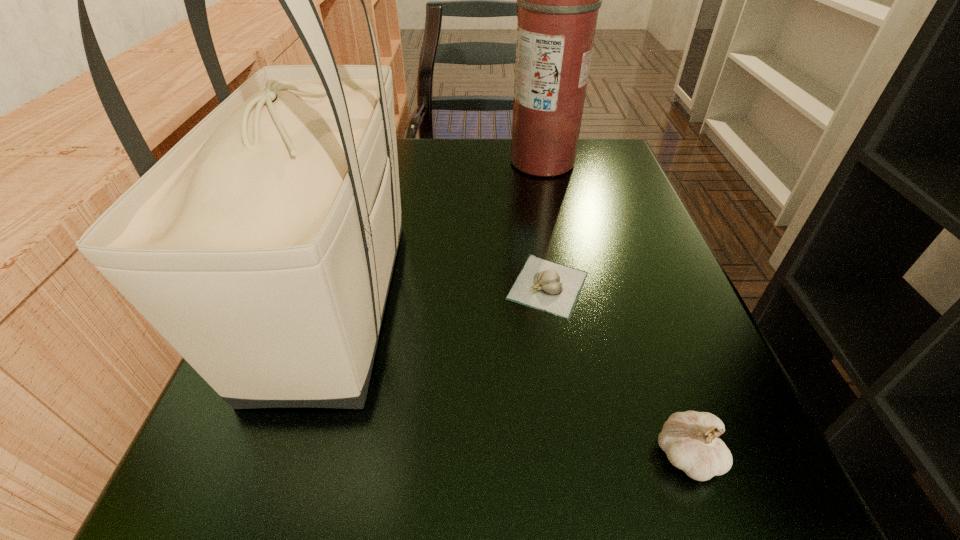
Where is `fire extinguisher`? The height and width of the screenshot is (540, 960). fire extinguisher is located at coordinates (558, 0).

You are a GUI agent. You are given a task and a screenshot of the screen. Output one action in this format:
    pyautogui.click(x=<x>, y=<y>)
    Task: Click on the shopping bag
    Image resolution: width=960 pixels, height=540 pixels.
    Given the screenshot: What is the action you would take?
    261,246

Locate an element on the screen. the taller garlic is located at coordinates (689, 439).

Where is `the third tallest object`? The height and width of the screenshot is (540, 960). the third tallest object is located at coordinates (689, 439).

The width and height of the screenshot is (960, 540). Identify the location of the left garlic. (547, 286).

Where is `the shorter garlic`? the shorter garlic is located at coordinates (547, 286).

Find the location of a particular element. free space located 0.110m on the front-facing side of the fire extinguisher is located at coordinates (458, 163).

This screenshot has width=960, height=540. Find the location of `vacant point located on the front-facing side of the fire extinguisher`. vacant point located on the front-facing side of the fire extinguisher is located at coordinates (384, 163).

Locate an element on the screen. free space located on the front-facing side of the fire extinguisher is located at coordinates point(337,163).

At what (x,y) coordinates should I click in order to perform the action: click on vacant space located 0.050m with handles facing forward on the leftmost object. Please return your answer as a coordinate pair (x, y). This screenshot has width=960, height=540. Looking at the image, I should click on (276, 480).